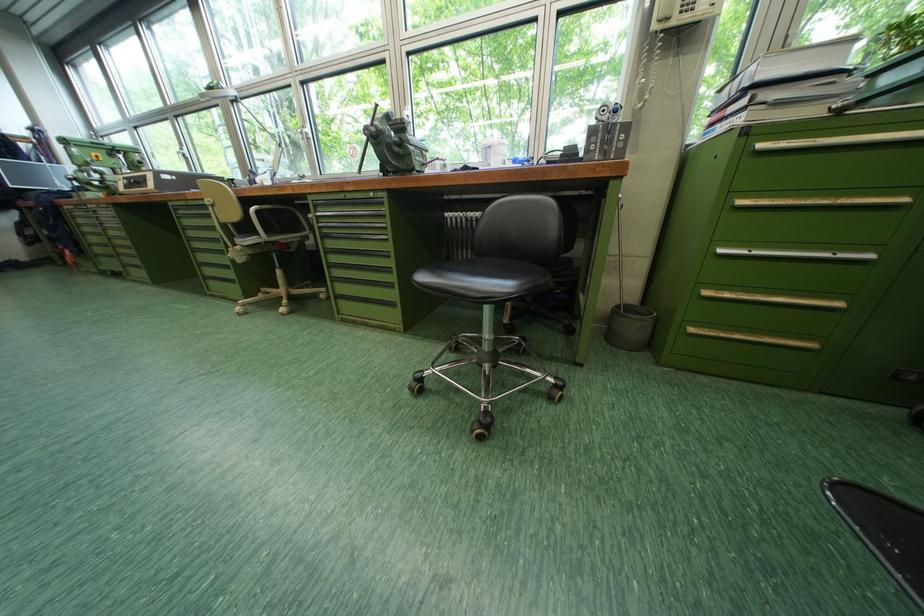
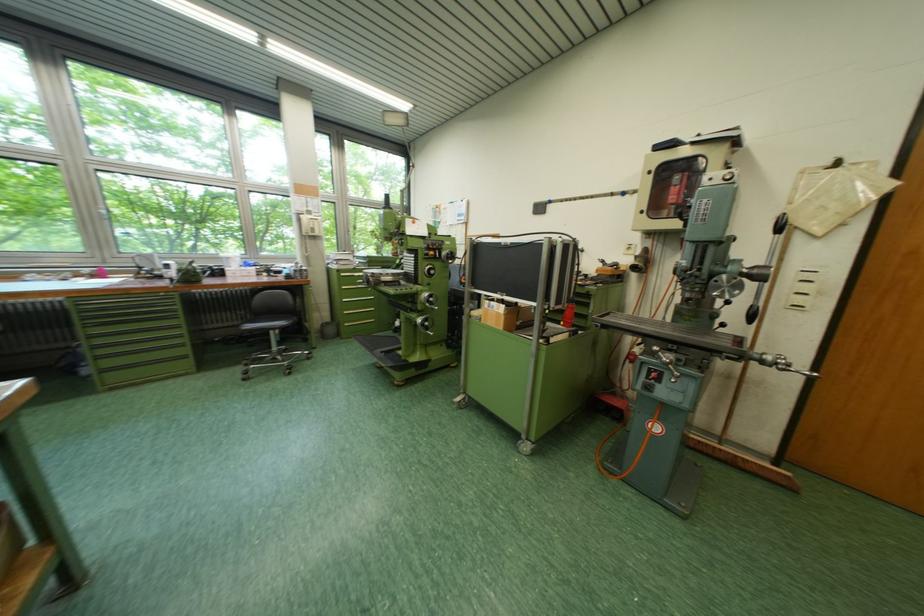
Find the pixel in the second image that matches (701,331) in the first image.

(357, 326)